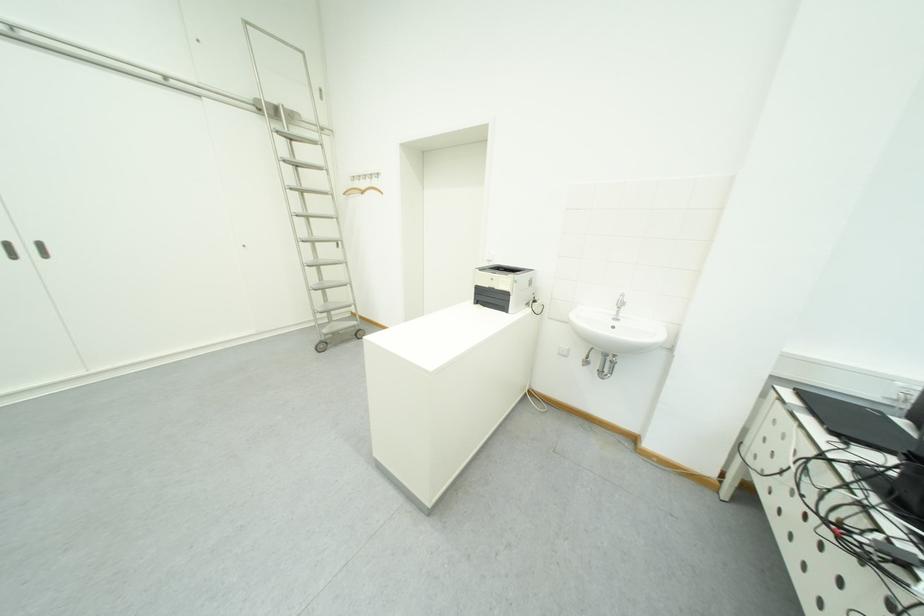
Where would you turn the faucet handle? Please return your answer as a coordinate pair (x, y).

(618, 306)